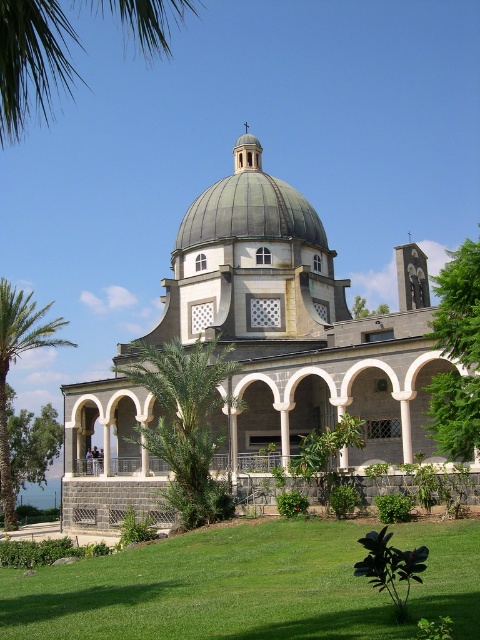
Is the position of green leafy palm tree at upper left more distant than that of green leafy tree at right?

No.

Describe the element at coordinates (33, 61) in the screenshot. I see `green leafy palm tree at upper left` at that location.

Image resolution: width=480 pixels, height=640 pixels. What are the coordinates of `green leafy palm tree at upper left` in the screenshot? It's located at (33, 61).

Locate an element on the screen. The width and height of the screenshot is (480, 640). green leafy palm tree at upper left is located at coordinates (33, 61).

Does green metallic dome at center have a greater width compared to green leafy tree at lower left?

In fact, green metallic dome at center might be narrower than green leafy tree at lower left.

Is green metallic dome at center shorter than green leafy tree at lower left?

In fact, green metallic dome at center may be taller than green leafy tree at lower left.

Is point (292, 230) less distant than point (15, 465)?

Yes, point (292, 230) is in front of point (15, 465).

Locate an element on the screen. green metallic dome at center is located at coordinates (249, 205).

Who is taller, green leafy palm tree at center or green metallic dome at center?

green metallic dome at center is taller.

This screenshot has width=480, height=640. I want to click on green leafy palm tree at center, so click(186, 422).